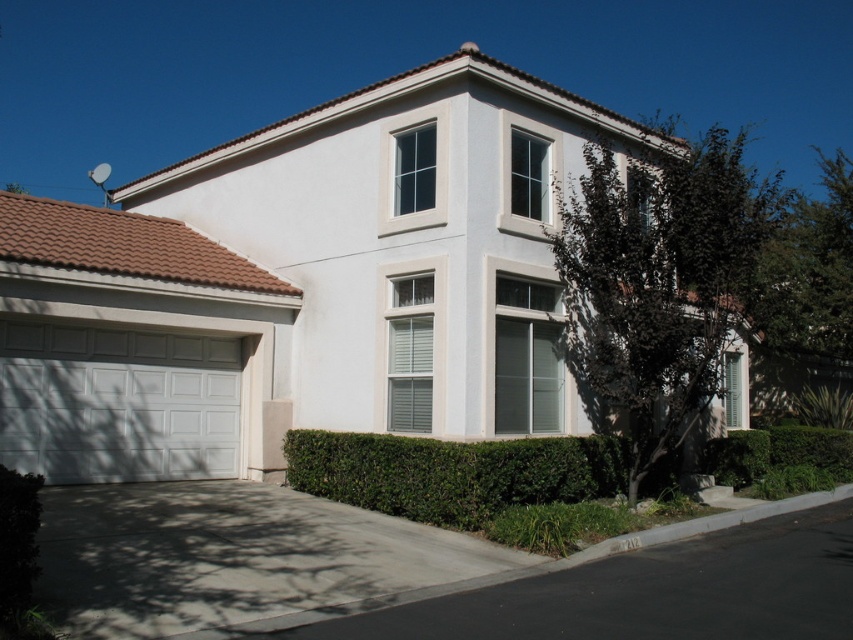
Question: Is dark green leafy tree at center-right to the right of white matte/glossy garage door at lower left from the viewer's perspective?

Choices:
 (A) yes
 (B) no

Answer: (A)

Question: Which object is closer to the camera taking this photo?

Choices:
 (A) gray concrete driveway at lower left
 (B) green leafy hedge at lower right

Answer: (A)

Question: Which of these objects is positioned closest to the white matte/glossy garage door at lower left?

Choices:
 (A) green leafy hedge at lower center
 (B) dark green leafy tree at center-right
 (C) green leafy hedge at lower right
 (D) gray concrete driveway at lower left

Answer: (D)

Question: Does white matte/glossy garage door at lower left have a lesser width compared to green leafy hedge at lower center?

Choices:
 (A) no
 (B) yes

Answer: (B)

Question: Can you confirm if gray concrete driveway at lower left is wider than green leafy hedge at lower center?

Choices:
 (A) yes
 (B) no

Answer: (B)

Question: Which of the following is the farthest from the observer?

Choices:
 (A) (755, 436)
 (B) (509, 484)
 (C) (128, 598)
 (D) (190, 452)

Answer: (A)